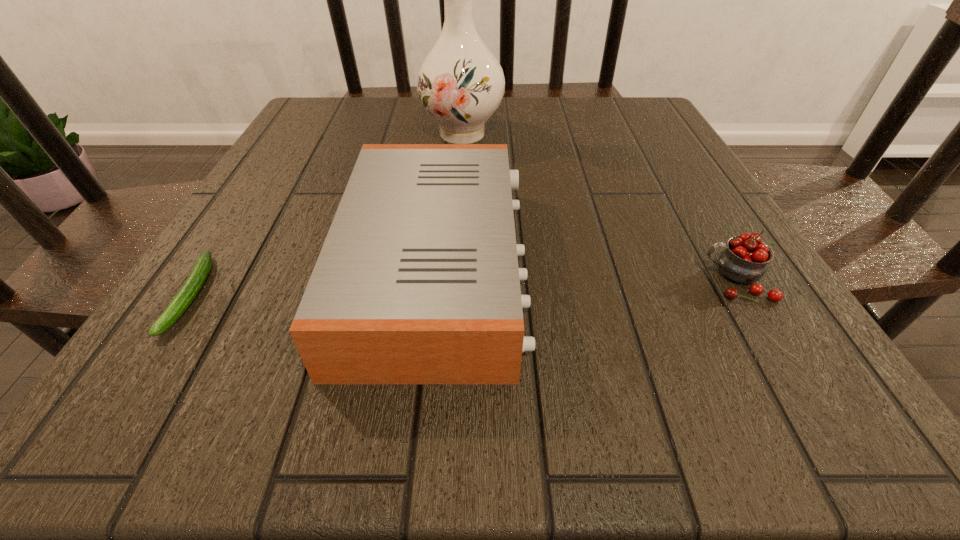
This screenshot has width=960, height=540. In order to click on vacant position in the image that satisfies the following two spatial constraints: 1. on the handle side of the cherry; 2. on the control panel of the radio receiver in this screenshot , I will do `click(729, 268)`.

Identify the location of free region that satisfies the following two spatial constraints: 1. on the control panel of the radio receiver; 2. on the handle side of the rightmost object. The width and height of the screenshot is (960, 540). (436, 280).

Locate an element on the screen. The image size is (960, 540). free space that satisfies the following two spatial constraints: 1. on the front side of the farthest object; 2. on the handle side of the rightmost object is located at coordinates (453, 280).

Where is `free space that satisfies the following two spatial constraints: 1. on the handle side of the rightmost object; 2. on the control panel of the radio receiver`? This screenshot has width=960, height=540. free space that satisfies the following two spatial constraints: 1. on the handle side of the rightmost object; 2. on the control panel of the radio receiver is located at coordinates (729, 268).

Identify the location of free space that satisfies the following two spatial constraints: 1. on the control panel of the radio receiver; 2. on the handle side of the cherry. This screenshot has width=960, height=540. (436, 280).